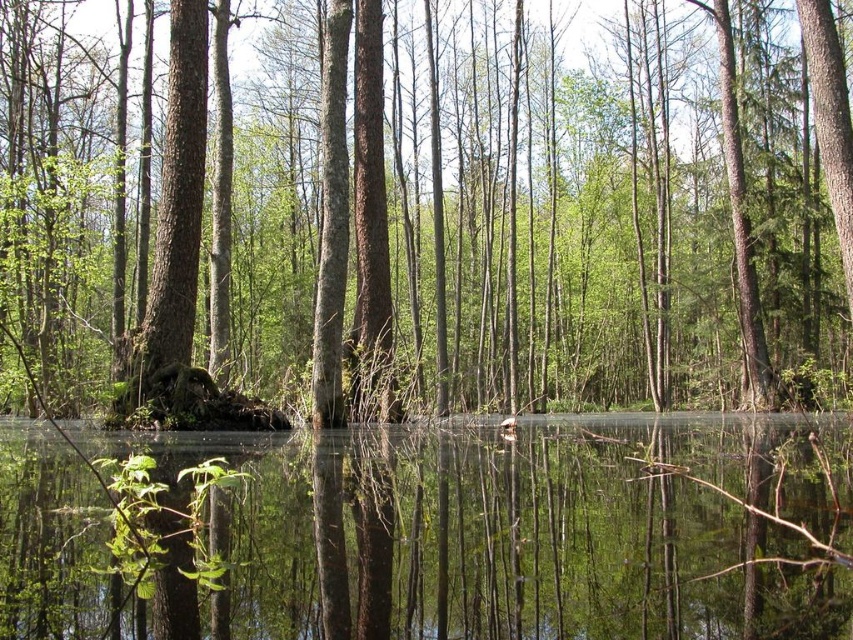
Question: Does green matte tree at center appear over clear water at center?

Choices:
 (A) yes
 (B) no

Answer: (A)

Question: Is green matte tree at center below clear water at center?

Choices:
 (A) yes
 (B) no

Answer: (B)

Question: Which point is closer to the camera?

Choices:
 (A) green matte tree at center
 (B) clear water at center

Answer: (B)

Question: Which object appears farthest from the camera in this image?

Choices:
 (A) clear water at center
 (B) green matte tree at center

Answer: (B)

Question: Can you confirm if green matte tree at center is positioned below clear water at center?

Choices:
 (A) yes
 (B) no

Answer: (B)